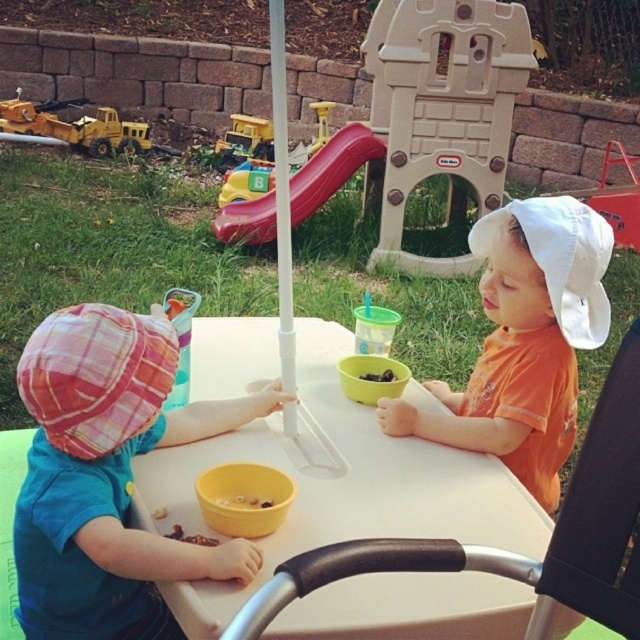
Who is more forward, (208,355) or (317,205)?

Point (208,355) is in front.

Is white plastic table at center shorter than rubberized plastic slide at center?

Yes, white plastic table at center is shorter than rubberized plastic slide at center.

The height and width of the screenshot is (640, 640). Describe the element at coordinates (336, 484) in the screenshot. I see `white plastic table at center` at that location.

Locate an element on the screen. The height and width of the screenshot is (640, 640). white plastic table at center is located at coordinates [x=336, y=484].

Which is in front, point (99, 148) or point (228, 141)?

Point (99, 148) is in front.

Can you confirm if yellow plastic toy truck at left is positioned to the right of metallic yellow toy truck at upper left?

Incorrect, yellow plastic toy truck at left is not on the right side of metallic yellow toy truck at upper left.

The width and height of the screenshot is (640, 640). Identify the location of yellow plastic toy truck at left. pos(74,125).

The image size is (640, 640). Identify the location of yellow plastic toy truck at left. (74, 125).

Which is more to the right, rubberized plastic slide at center or dark chocolate chips at center?

From the viewer's perspective, dark chocolate chips at center appears more on the right side.

Can you confirm if rubberized plastic slide at center is positioned above dark chocolate chips at center?

Yes.

Describe the element at coordinates (332, 168) in the screenshot. Image resolution: width=640 pixels, height=640 pixels. I see `rubberized plastic slide at center` at that location.

Where is `rubberized plastic slide at center`? This screenshot has width=640, height=640. rubberized plastic slide at center is located at coordinates (332, 168).